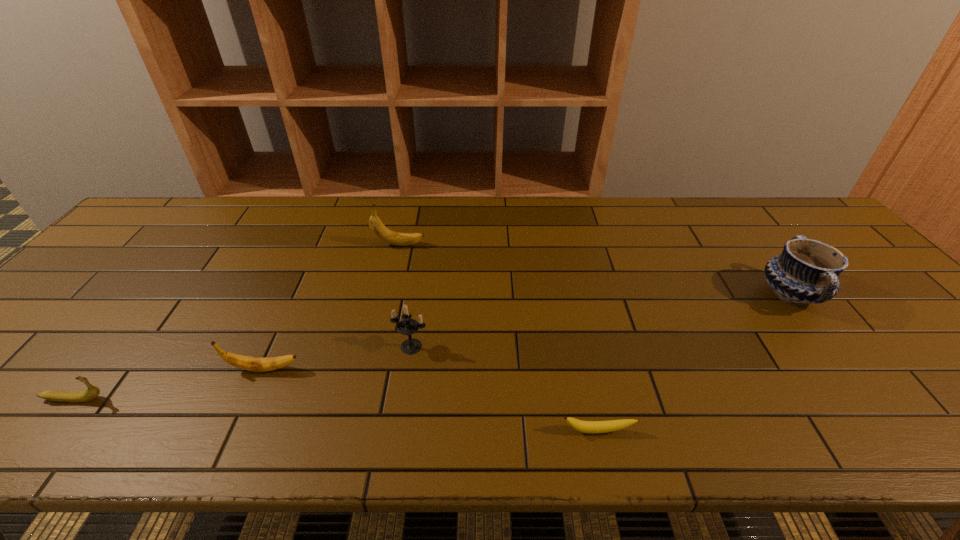
The width and height of the screenshot is (960, 540). What are the coordinates of `the nearest banana` in the screenshot? It's located at (591, 427).

You are a GUI agent. You are given a task and a screenshot of the screen. Output one action in this format:
    pyautogui.click(x=<x>, y=<y>)
    Task: Click on the vacant space located at the start of the peel on the third banana from left to right
    
    Given the screenshot: What is the action you would take?
    pyautogui.click(x=498, y=245)

The image size is (960, 540). I want to click on vacant region located on the left of the rightmost object, so [623, 294].

Find the location of a particular element. free space located 0.060m on the right of the candle holder is located at coordinates (454, 347).

Locate an element on the screen. Image resolution: width=960 pixels, height=540 pixels. blank space located 0.400m on the peel of the third nearest object from the top is located at coordinates (481, 369).

Where is `vacant region located 0.170m at the stem of the second nearest object`? vacant region located 0.170m at the stem of the second nearest object is located at coordinates (186, 399).

Where is `object that is at the near edge`? The height and width of the screenshot is (540, 960). object that is at the near edge is located at coordinates (591, 427).

I want to click on vacant space at the far edge of the desktop, so click(320, 238).

The image size is (960, 540). What are the coordinates of `vacant position at the near edge of the desktop` in the screenshot? It's located at (935, 428).

Where is `vacant area at the right edge`? The image size is (960, 540). vacant area at the right edge is located at coordinates (854, 275).